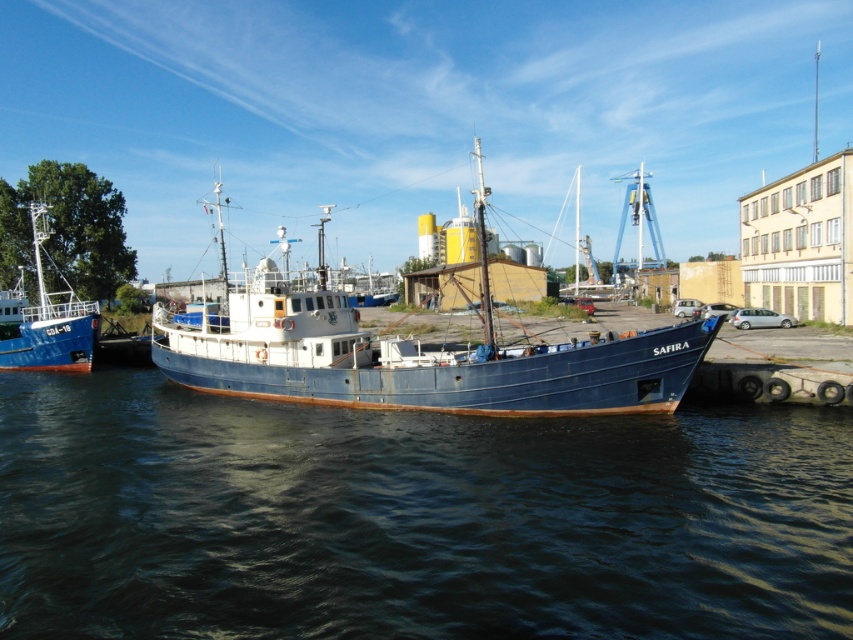
Who is higher up, rusty metal boat at center or brushed metal boat at left?

Positioned higher is rusty metal boat at center.

Does rusty metal boat at center have a larger size compared to brushed metal boat at left?

Correct, rusty metal boat at center is larger in size than brushed metal boat at left.

At what (x,y) coordinates should I click in order to perform the action: click on rusty metal boat at center. Please return your answer as a coordinate pair (x, y). The image size is (853, 640). Looking at the image, I should click on (416, 355).

Is dark blue water at center further to the viewer compared to brushed metal boat at left?

That is False.

Is dark blue water at center positioned before brushed metal boat at left?

Yes, dark blue water at center is in front of brushed metal boat at left.

Identify the location of dark blue water at center. This screenshot has height=640, width=853. (412, 518).

Image resolution: width=853 pixels, height=640 pixels. I want to click on dark blue water at center, so click(412, 518).

Who is lower down, dark blue water at center or rusty metal boat at center?

dark blue water at center is below.

Image resolution: width=853 pixels, height=640 pixels. Identify the location of dark blue water at center. (412, 518).